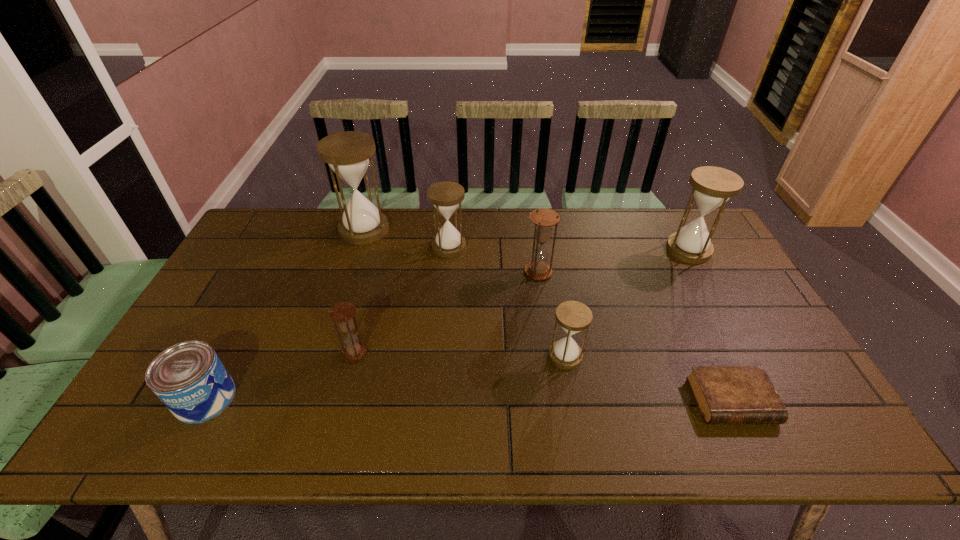
I want to click on unoccupied position between the right brown hourglass and the smallest white hourglass, so click(552, 314).

Image resolution: width=960 pixels, height=540 pixels. I want to click on vacant area that lies between the smaller brown hourglass and the biggest white hourglass, so click(x=359, y=291).

Choose which object is the fourth nearest neighbor to the second tallest hourglass. Please provide its 2D coordinates. Your answer should be formatted as a tuple, i.e. [(x, y)], where the tuple contains the x and y coordinates of a point satisfying the conditions above.

[(446, 196)]

This screenshot has height=540, width=960. Find the location of `object that ranks as the second closest to the fifth object from right to left`. object that ranks as the second closest to the fifth object from right to left is located at coordinates (544, 219).

Image resolution: width=960 pixels, height=540 pixels. I want to click on hourglass that is the closest to the left brown hourglass, so click(x=446, y=196).

Where is `hourglass that stands as the third closest to the second shortest object`? hourglass that stands as the third closest to the second shortest object is located at coordinates (446, 196).

Locate an element on the screen. Image resolution: width=960 pixels, height=540 pixels. the second closest white hourglass to the third white hourglass from right to left is located at coordinates (573, 316).

Select which white hourglass appears as the third closest to the smaller brown hourglass. Please provide its 2D coordinates. Your answer should be formatted as a tuple, i.e. [(x, y)], where the tuple contains the x and y coordinates of a point satisfying the conditions above.

[(573, 316)]

Find the location of a particular element. The width and height of the screenshot is (960, 540). vacant space that satisfies the following two spatial constraints: 1. on the back side of the left brown hourglass; 2. on the left side of the farther brown hourglass is located at coordinates (375, 272).